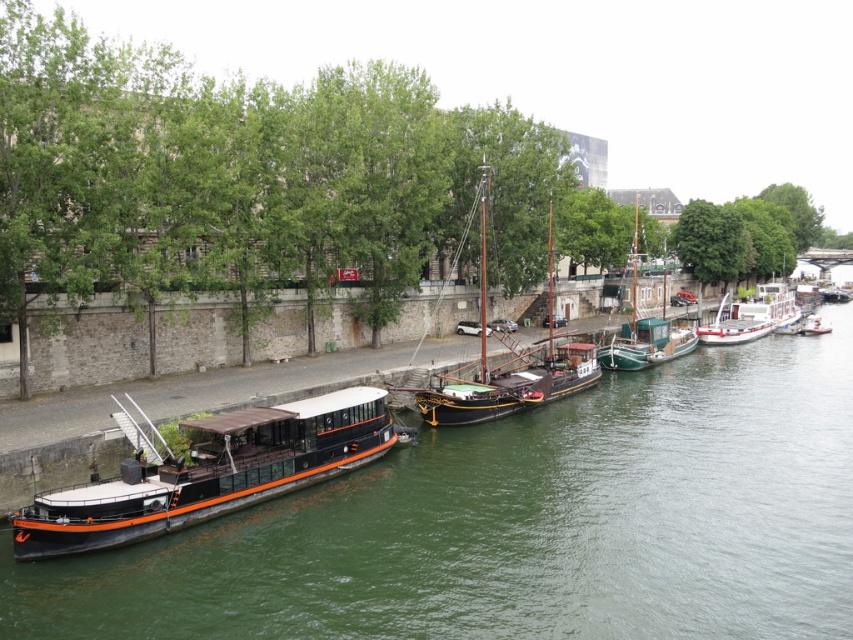
Question: Considering the real-world distances, which object is closest to the green water at lower left?

Choices:
 (A) white glossy barge at right
 (B) green wooden sailboat at center
 (C) wooden sailboat at center

Answer: (C)

Question: Which of the following is the farthest from the observer?

Choices:
 (A) (741, 340)
 (B) (579, 381)
 (C) (633, 536)

Answer: (A)

Question: Which point is closer to the camera?

Choices:
 (A) (798, 340)
 (B) (473, 413)
 (C) (160, 472)
 (D) (611, 364)

Answer: (C)

Question: Does green water at lower left appear on the left side of white glossy barge at right?

Choices:
 (A) no
 (B) yes

Answer: (B)

Question: Can you confirm if green water at lower left is positioned below orange glossy barge at center?

Choices:
 (A) no
 (B) yes

Answer: (B)

Question: In this image, where is wooden sailboat at center located relative to white glossy barge at right?

Choices:
 (A) left
 (B) right

Answer: (A)